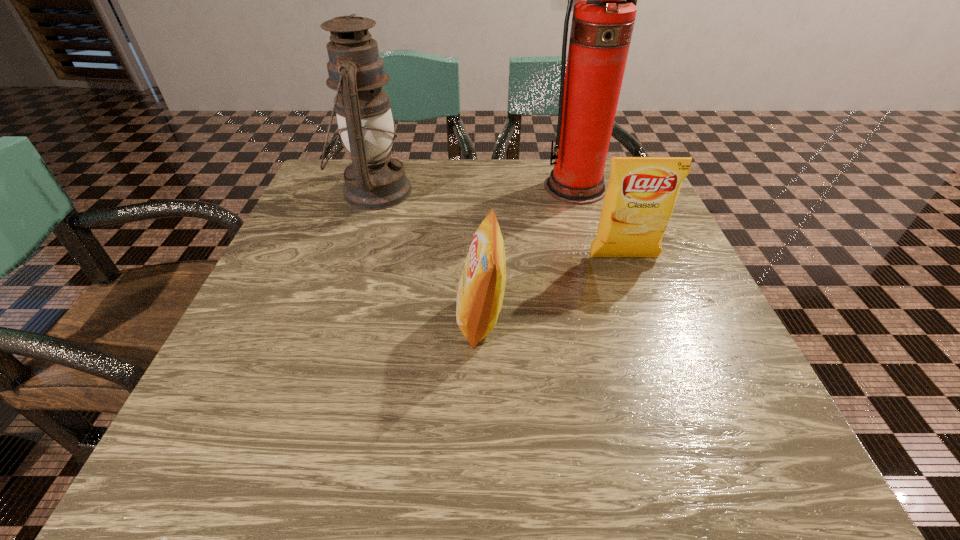
This screenshot has width=960, height=540. I want to click on the tallest object, so click(x=603, y=19).

Locate an element on the screen. The image size is (960, 540). the leftmost object is located at coordinates (373, 181).

Locate an element on the screen. The height and width of the screenshot is (540, 960). the third shortest object is located at coordinates (373, 181).

Image resolution: width=960 pixels, height=540 pixels. Find the location of `the farther crisp (potato chip)`. the farther crisp (potato chip) is located at coordinates (642, 191).

Locate an element on the screen. This screenshot has height=540, width=960. the third tallest object is located at coordinates (642, 191).

Identify the location of the nearest object. The height and width of the screenshot is (540, 960). (480, 292).

Identify the location of the left crisp (potato chip). The height and width of the screenshot is (540, 960). (480, 292).

At what (x,y) coordinates should I click in order to perform the action: click on vacant point located at the discharge end of the fire extinguisher. Please return your answer as a coordinate pair (x, y). Looking at the image, I should click on (586, 223).

The height and width of the screenshot is (540, 960). I want to click on vacant space located on the left of the oil lamp, so click(316, 191).

The width and height of the screenshot is (960, 540). Identify the location of vacant area situated on the front of the farther crisp (potato chip) with the logo. (658, 351).